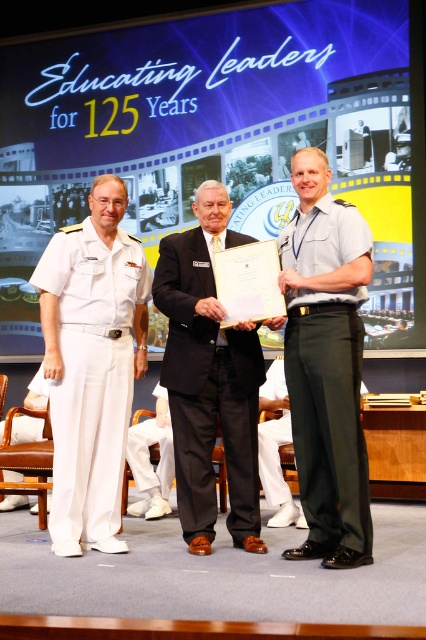
Question: Which point is farther from the camera taking this photo?

Choices:
 (A) (158, 484)
 (B) (353, 413)
 (C) (58, 342)

Answer: (A)

Question: Does white cotton pants at left have a lesser width compared to white cotton pants at lower center?

Choices:
 (A) yes
 (B) no

Answer: (B)

Question: Can you confirm if white cotton pants at left is thinner than black wool suit at center?

Choices:
 (A) no
 (B) yes

Answer: (B)

Question: Which of these objects is positioned closest to the white cotton pants at lower center?

Choices:
 (A) green cotton pants at center
 (B) white cotton pants at left

Answer: (B)

Question: Which point is farther from the camera taking this photo?

Choices:
 (A) (336, 262)
 (B) (146, 481)
 (C) (173, 408)
 (D) (141, 262)

Answer: (B)

Question: Does green cotton pants at center come in front of black wool suit at center?

Choices:
 (A) yes
 (B) no

Answer: (A)